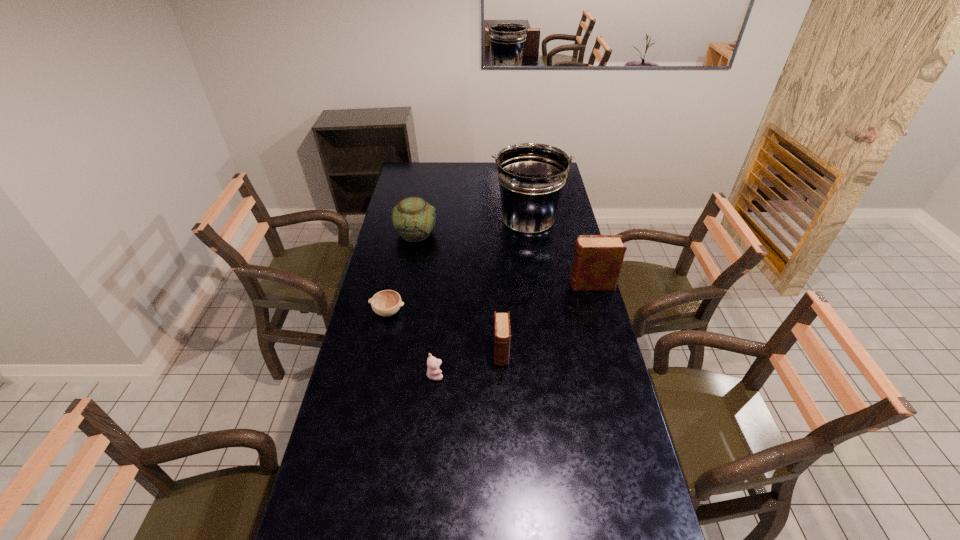
You are a GUI agent. You are given a task and a screenshot of the screen. Output one action in this format:
    pyautogui.click(x=<x>, y=<y>)
    Task: Click on the vacant area that lies between the fourth nearest object and the shortest object
    
    Given the screenshot: What is the action you would take?
    pyautogui.click(x=490, y=298)

The height and width of the screenshot is (540, 960). I want to click on vacant area between the farther diary and the fifth farthest object, so click(546, 319).

The height and width of the screenshot is (540, 960). What are the coordinates of `empty space between the tallest object and the nearest object` in the screenshot? It's located at (482, 299).

Where is `free spot between the shorter diary and the nearest object`? free spot between the shorter diary and the nearest object is located at coordinates (468, 363).

At what (x,y) coordinates should I click in order to perform the action: click on unoccupied position between the third nearest object and the fourth nearest object. Please return your answer as a coordinate pair (x, y). The image size is (960, 540). Looking at the image, I should click on (490, 298).

I want to click on empty space between the tallest object and the pottery, so click(471, 228).

The height and width of the screenshot is (540, 960). Find the location of `vacant space that's between the third object from left to right and the pottery`. vacant space that's between the third object from left to right and the pottery is located at coordinates (425, 304).

At what (x,y) coordinates should I click in order to perform the action: click on object that can be found as the fourth closest to the shorter diary. Please return your answer as a coordinate pair (x, y). This screenshot has width=960, height=540. Looking at the image, I should click on (531, 176).

Select which object appears as the closest to the teddy bear. Please provide its 2D coordinates. Your answer should be formatted as a tuple, i.e. [(x, y)], where the tuple contains the x and y coordinates of a point satisfying the conditions above.

[(502, 333)]

Image resolution: width=960 pixels, height=540 pixels. I want to click on free spot that satisfies the following two spatial constraints: 1. on the spine side of the taller diary; 2. on the spine side of the shorter diary, so click(x=610, y=353).